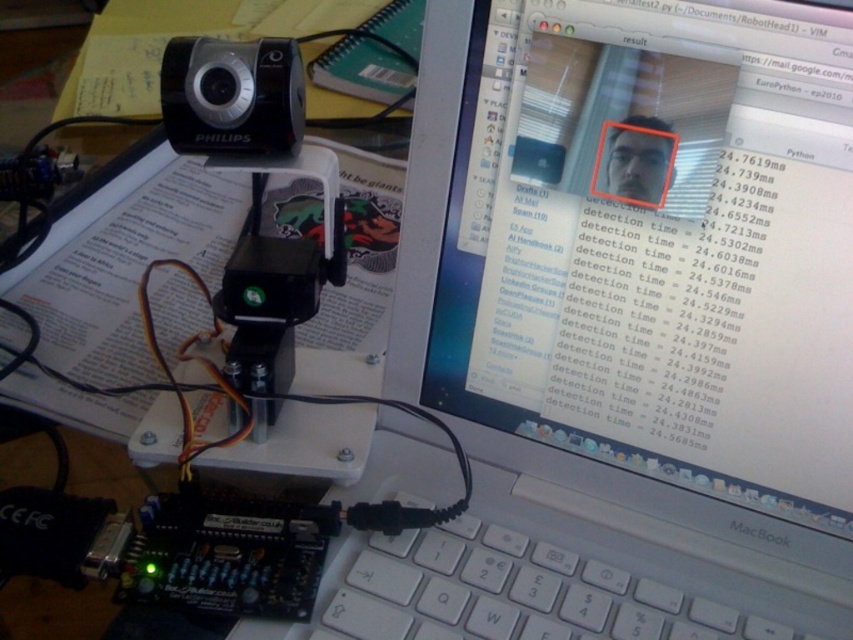
Question: Does matte black monitor at upper center have a lesser width compared to white plastic keyboard at lower center?

Choices:
 (A) no
 (B) yes

Answer: (B)

Question: Which of the following is the farthest from the observer?

Choices:
 (A) (224, 81)
 (B) (448, 234)

Answer: (B)

Question: Does matte black monitor at upper center have a lesser width compared to white plastic keyboard at lower center?

Choices:
 (A) no
 (B) yes

Answer: (B)

Question: Can you confirm if white plastic keyboard at lower center is smaller than black plastic camera at upper left?

Choices:
 (A) yes
 (B) no

Answer: (B)

Question: Estimate the real-world distances between objects in this image. Which object is farther from the black plastic camera at upper left?

Choices:
 (A) matte black monitor at upper center
 (B) white plastic keyboard at lower center

Answer: (B)

Question: Which point is farther to the camera?

Choices:
 (A) matte black monitor at upper center
 (B) black plastic camera at upper left

Answer: (B)